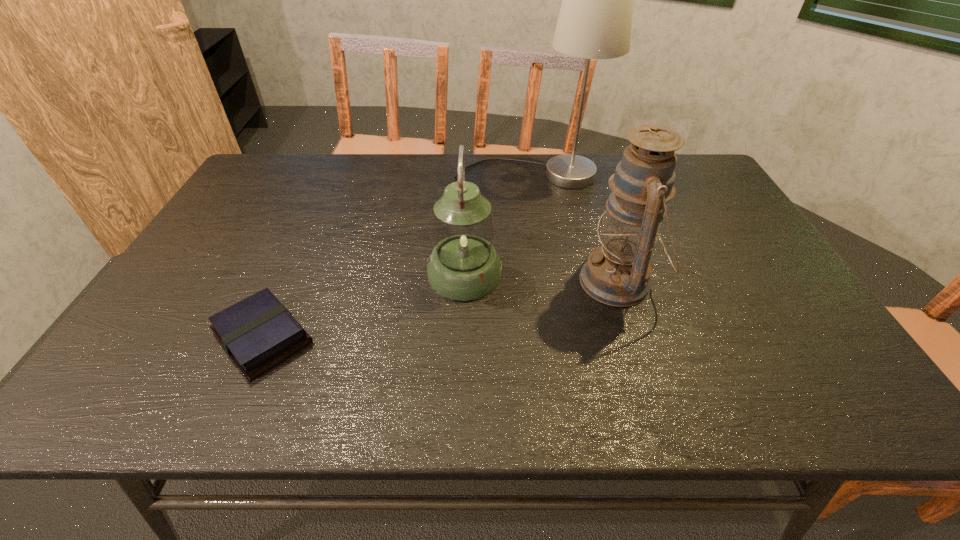
Locate an element on the screen. The height and width of the screenshot is (540, 960). object situated at the far edge is located at coordinates (595, 19).

Identify the location of object that is at the near edge. pyautogui.click(x=258, y=333).

The width and height of the screenshot is (960, 540). What are the coordinates of `vacant region at the far edge of the desktop` in the screenshot? It's located at (512, 154).

The width and height of the screenshot is (960, 540). Find the location of `free location at the near edge of the desktop`. free location at the near edge of the desktop is located at coordinates (324, 394).

Locate an element on the screen. The width and height of the screenshot is (960, 540). free space at the left edge is located at coordinates (184, 285).

You are a GUI agent. You are given a task and a screenshot of the screen. Output one action in this format:
    pyautogui.click(x=<x>, y=<y>)
    Task: Click on the vacant region between the table lamp and the leftmost object
    The height and width of the screenshot is (540, 960).
    Given the screenshot: What is the action you would take?
    pyautogui.click(x=396, y=256)

You are a GUI agent. You are given a task and a screenshot of the screen. Output one action in this format:
    pyautogui.click(x=<x>, y=<y>)
    Task: Click on the free space between the second shortest object and the shortest object
    The image size is (960, 540).
    Given the screenshot: What is the action you would take?
    pyautogui.click(x=364, y=306)

Identify the location of free space between the second tallest object and the table lamp. The width and height of the screenshot is (960, 540). (573, 229).

What are the coordinates of `empty space between the oil lamp and the lantern` in the screenshot? It's located at (541, 278).

This screenshot has height=540, width=960. I want to click on free spot between the third shortest object and the lantern, so click(x=541, y=278).